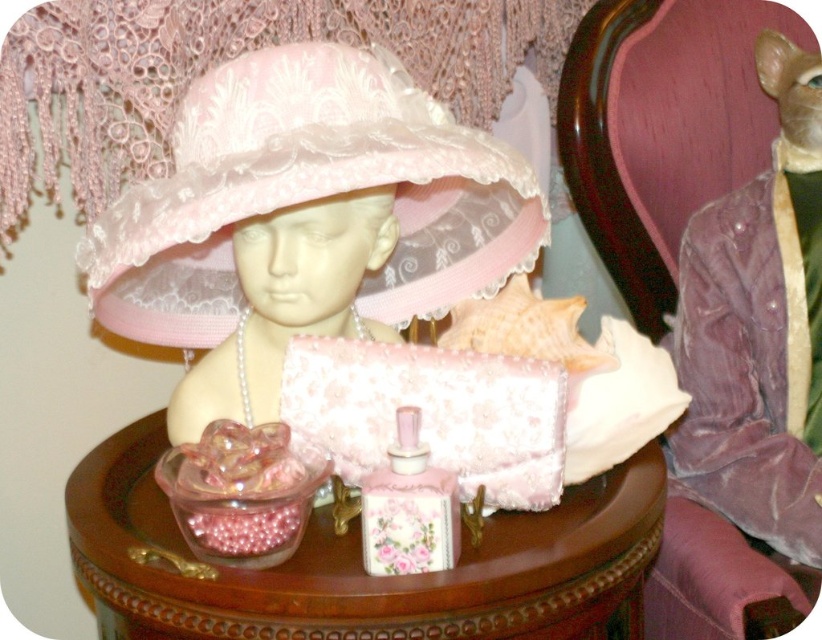
Question: Among these objects, which one is nearest to the camera?

Choices:
 (A) porcelain floral vase at center
 (B) matte pink lace hat at center

Answer: (A)

Question: Which of the following is the farthest from the observer?

Choices:
 (A) velvet purple chair at upper right
 (B) lace-like fabric hat at center

Answer: (A)

Question: Is lace-like fabric hat at center bigger than matte pink lace hat at center?

Choices:
 (A) no
 (B) yes

Answer: (B)

Question: Is matte pink lace hat at center wider than velvet purple chair at upper right?

Choices:
 (A) no
 (B) yes

Answer: (A)

Question: Can you confirm if lace-like fabric hat at center is positioned to the left of velvet purple chair at upper right?

Choices:
 (A) no
 (B) yes

Answer: (B)

Question: Which point is closer to the camera?

Choices:
 (A) lace-like fabric hat at center
 (B) matte pink lace hat at center

Answer: (A)